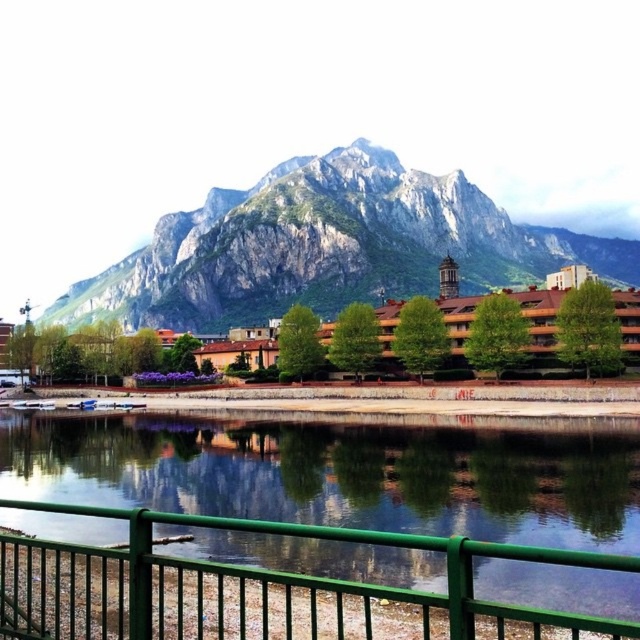
Who is more forward, (253, 602) or (627, 337)?

Point (253, 602)

Consider the image. Does green metallic river at center have a smaller size compared to brown wooden houses at center?

Yes, green metallic river at center is smaller than brown wooden houses at center.

Is point (106, 561) less distant than point (451, 310)?

Yes, point (106, 561) is in front of point (451, 310).

What are the coordinates of `green metallic river at center` in the screenshot? It's located at (237, 497).

Describe the element at coordinates (326, 246) in the screenshot. I see `rugged stone mountain at upper center` at that location.

Which of these two, rugged stone mountain at upper center or brown wooden houses at center, stands taller?

With more height is rugged stone mountain at upper center.

I want to click on rugged stone mountain at upper center, so click(326, 246).

Where is `rugged stone mountain at upper center`? This screenshot has width=640, height=640. rugged stone mountain at upper center is located at coordinates (326, 246).

How distant is green metallic river at center from rugged stone mountain at upper center?

green metallic river at center and rugged stone mountain at upper center are 619.89 feet apart.

Is green metallic river at center bigger than rugged stone mountain at upper center?

Actually, green metallic river at center might be smaller than rugged stone mountain at upper center.

What are the coordinates of `green metallic river at center` in the screenshot? It's located at (237, 497).